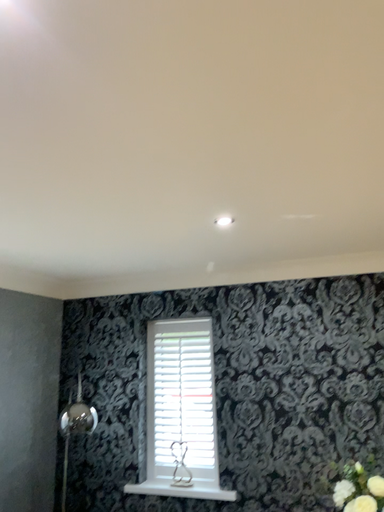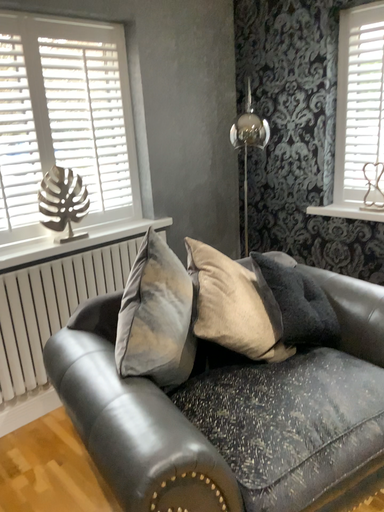
Question: How did the camera likely rotate when shooting the video?

Choices:
 (A) rotated upward
 (B) rotated downward

Answer: (B)